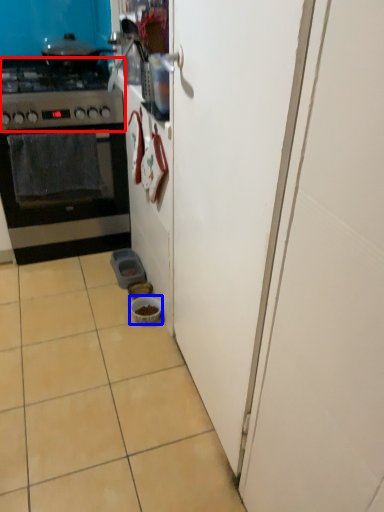
Question: Among these objects, which one is farthest to the camera, gas stove (highlighted by a red box) or bowl (highlighted by a blue box)?

Choices:
 (A) gas stove
 (B) bowl

Answer: (B)